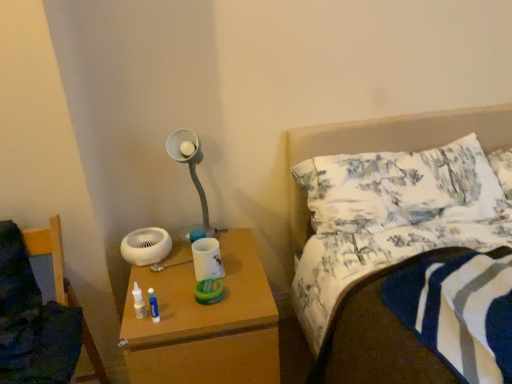
At what (x,y) coordinates should I click in order to perform the action: click on wooden chair at lower left. Please return your answer as a coordinate pair (x, y). The image size is (512, 384). Looking at the image, I should click on (41, 312).

The height and width of the screenshot is (384, 512). I want to click on white matte lamp at upper center, so click(x=190, y=166).

Locate an element on the screen. This screenshot has height=384, width=512. white printed fabric pillow at upper right is located at coordinates (399, 188).

Is there a large distance between wooden chair at lower left and wooden nightstand at lower center?

No, wooden chair at lower left is not far away from wooden nightstand at lower center.

Is wooden chair at lower left oriented towards wooden nightstand at lower center?

No, wooden chair at lower left is not turned towards wooden nightstand at lower center.

Between wooden chair at lower left and wooden nightstand at lower center, which one has larger size?

Bigger between the two is wooden nightstand at lower center.

Between wooden chair at lower left and wooden nightstand at lower center, which one appears on the left side from the viewer's perspective?

wooden chair at lower left.

Can you tell me how much wooden chair at lower left and white printed fabric pillow at upper right differ in facing direction?

The angular difference between wooden chair at lower left and white printed fabric pillow at upper right is 0.65 degrees.

Is wooden chair at lower left inside or outside of white printed fabric pillow at upper right?

wooden chair at lower left is not enclosed by white printed fabric pillow at upper right.

Looking at the image, does wooden chair at lower left seem bigger or smaller compared to white printed fabric pillow at upper right?

wooden chair at lower left is bigger than white printed fabric pillow at upper right.

Relative to white printed fabric pillow at upper right, is wooden chair at lower left in front or behind?

wooden chair at lower left is in front of white printed fabric pillow at upper right.

Is wooden nightstand at lower center wider or thinner than wooden chair at lower left?

In the image, wooden nightstand at lower center appears to be wider than wooden chair at lower left.

Is wooden nightstand at lower center behind wooden chair at lower left?

Yes, wooden nightstand at lower center is behind wooden chair at lower left.

The width and height of the screenshot is (512, 384). What are the coordinates of `nightstand lying on the right of wooden chair at lower left` in the screenshot? It's located at point(205,324).

From a real-world perspective, is wooden nightstand at lower center on wooden chair at lower left?

Actually, wooden nightstand at lower center is physically below wooden chair at lower left in the real world.

Which is behind, white matte lamp at upper center or white printed fabric pillow at upper right?

white matte lamp at upper center is more distant.

Consider the image. From the image's perspective, is white matte lamp at upper center positioned above or below white printed fabric pillow at upper right?

From the image's perspective, white matte lamp at upper center appears above white printed fabric pillow at upper right.

Is white matte lamp at upper center to the left of white printed fabric pillow at upper right from the viewer's perspective?

Yes, white matte lamp at upper center is to the left of white printed fabric pillow at upper right.

From a real-world perspective, is white matte lamp at upper center under white printed fabric pillow at upper right?

Actually, white matte lamp at upper center is physically above white printed fabric pillow at upper right in the real world.

Is white printed fabric pillow at upper right at the left side of wooden chair at lower left?

In fact, white printed fabric pillow at upper right is to the right of wooden chair at lower left.

Is white printed fabric pillow at upper right far away from wooden chair at lower left?

No, white printed fabric pillow at upper right is not far from wooden chair at lower left.

Identify the location of furniture that is in front of the white printed fabric pillow at upper right. The width and height of the screenshot is (512, 384). (41, 312).

Does point (442, 167) come closer to viewer compared to point (188, 148)?

No, (442, 167) is behind (188, 148).

Is white printed fabric pillow at upper right closer to camera compared to white matte lamp at upper center?

Yes, white printed fabric pillow at upper right is in front of white matte lamp at upper center.

Can you confirm if white printed fabric pillow at upper right is shorter than white matte lamp at upper center?

Yes, white printed fabric pillow at upper right is shorter than white matte lamp at upper center.

Is white printed fabric pillow at upper right bigger than white matte lamp at upper center?

Yes.

Is white printed fabric pillow at upper right next to wooden nightstand at lower center?

white printed fabric pillow at upper right and wooden nightstand at lower center are clearly separated.

Who is smaller, white printed fabric pillow at upper right or wooden nightstand at lower center?

white printed fabric pillow at upper right.

Considering the relative positions of white printed fabric pillow at upper right and wooden nightstand at lower center in the image provided, is white printed fabric pillow at upper right to the left of wooden nightstand at lower center from the viewer's perspective?

No.

From a real-world perspective, does white printed fabric pillow at upper right sit lower than wooden nightstand at lower center?

No, from a real-world perspective, white printed fabric pillow at upper right is not under wooden nightstand at lower center.

You are a GUI agent. You are given a task and a screenshot of the screen. Output one action in this format:
    pyautogui.click(x=<x>, y=<y>)
    Task: Click on the nightstand located underneath the wooden chair at lower left (from a real-world perspective)
    This screenshot has height=384, width=512.
    Given the screenshot: What is the action you would take?
    pyautogui.click(x=205, y=324)

Where is `pillow that is behind the wooden chair at lower left`? Image resolution: width=512 pixels, height=384 pixels. pillow that is behind the wooden chair at lower left is located at coordinates (399, 188).

Considering their positions, is wooden chair at lower left positioned further to white matte lamp at upper center than wooden nightstand at lower center?

The object further to white matte lamp at upper center is wooden chair at lower left.

Based on their spatial positions, is wooden chair at lower left or white matte lamp at upper center closer to white printed fabric pillow at upper right?

white matte lamp at upper center is closer to white printed fabric pillow at upper right.

Looking at the image, which one is located closer to wooden chair at lower left, white printed fabric pillow at upper right or white matte lamp at upper center?

white matte lamp at upper center is closer to wooden chair at lower left.

Consider the image. When comparing their distances from white printed fabric pillow at upper right, does wooden chair at lower left or wooden nightstand at lower center seem further?

Among the two, wooden chair at lower left is located further to white printed fabric pillow at upper right.

When comparing their distances from wooden chair at lower left, does wooden nightstand at lower center or white matte lamp at upper center seem further?

white matte lamp at upper center is positioned further to the anchor wooden chair at lower left.

Looking at the image, which one is located further to wooden chair at lower left, white printed fabric pillow at upper right or wooden nightstand at lower center?

Based on the image, white printed fabric pillow at upper right appears to be further to wooden chair at lower left.

Considering their positions, is wooden nightstand at lower center positioned further to white matte lamp at upper center than wooden chair at lower left?

wooden chair at lower left lies further to white matte lamp at upper center than the other object.

Estimate the real-world distances between objects in this image. Which object is further from wooden nightstand at lower center, white printed fabric pillow at upper right or wooden chair at lower left?

Among the two, white printed fabric pillow at upper right is located further to wooden nightstand at lower center.

I want to click on nightstand between white matte lamp at upper center and white printed fabric pillow at upper right in the horizontal direction, so click(x=205, y=324).

Locate an element on the screen. Image resolution: width=512 pixels, height=384 pixels. furniture between white matte lamp at upper center and wooden nightstand at lower center vertically is located at coordinates click(x=41, y=312).

Where is `nightstand between wooden chair at lower left and white printed fabric pillow at upper right in the horizontal direction`? Image resolution: width=512 pixels, height=384 pixels. nightstand between wooden chair at lower left and white printed fabric pillow at upper right in the horizontal direction is located at coordinates (205, 324).

Find the location of a particular element. The height and width of the screenshot is (384, 512). lamp between wooden chair at lower left and white printed fabric pillow at upper right is located at coordinates (190, 166).